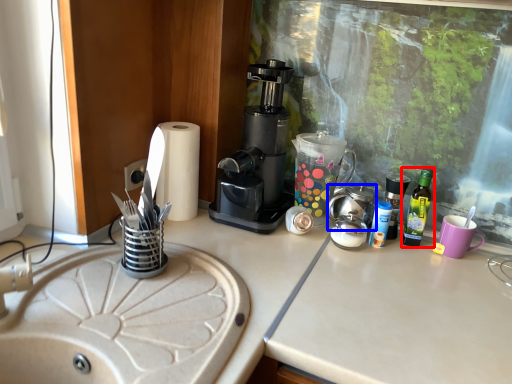
Question: Which object appears farthest to the camera in this image, bottle (highlighted by a red box) or appliance (highlighted by a blue box)?

Choices:
 (A) bottle
 (B) appliance

Answer: (A)